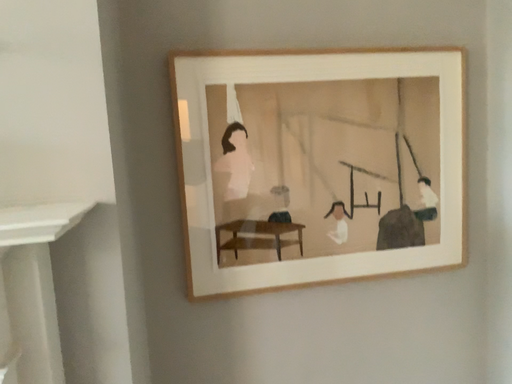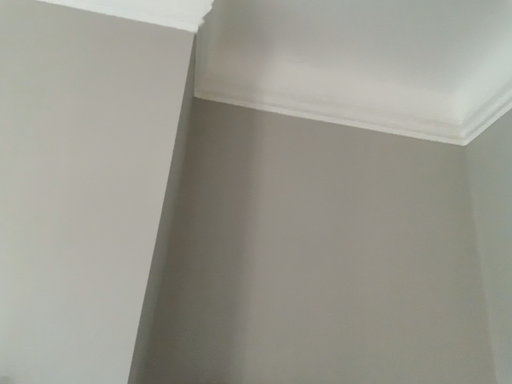
Question: Which way did the camera rotate in the video?

Choices:
 (A) rotated downward
 (B) rotated upward

Answer: (B)